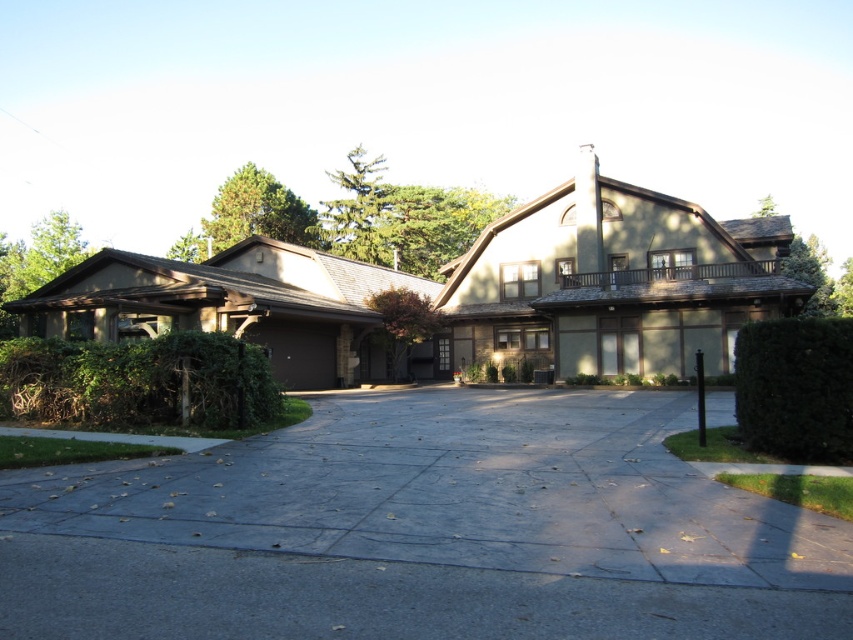
Is gray concrete driveway at center above green leafy hedge at right?

Actually, gray concrete driveway at center is below green leafy hedge at right.

Measure the distance between point (62, 481) and camera.

A distance of 8.15 meters exists between point (62, 481) and camera.

Where is `gray concrete driveway at center`? gray concrete driveway at center is located at coordinates (422, 531).

Who is positioned more to the left, gray concrete driveway at center or green leafy hedge at lower left?

Positioned to the left is green leafy hedge at lower left.

From the picture: Which is above, gray concrete driveway at center or green leafy hedge at lower left?

Positioned higher is green leafy hedge at lower left.

Is point (491, 508) farther from camera compared to point (140, 348)?

No, (491, 508) is in front of (140, 348).

In order to click on gray concrete driveway at center in this screenshot , I will do `click(422, 531)`.

Does green leafy hedge at lower left come in front of green leafy hedge at right?

No.

Describe the element at coordinates (138, 381) in the screenshot. Image resolution: width=853 pixels, height=640 pixels. I see `green leafy hedge at lower left` at that location.

Is point (148, 401) closer to camera compared to point (772, 406)?

No, it is not.

This screenshot has height=640, width=853. I want to click on green leafy hedge at lower left, so click(x=138, y=381).